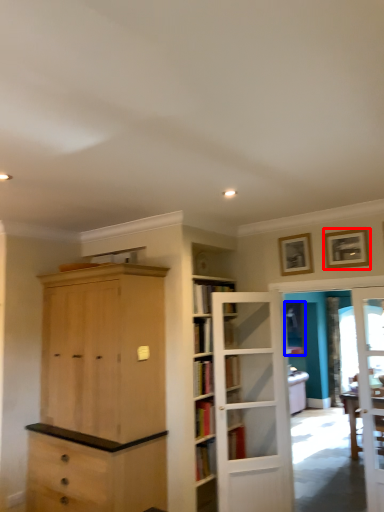
Question: Which of the following is the farthest to the observer, picture frame (highlighted by a red box) or window (highlighted by a blue box)?

Choices:
 (A) picture frame
 (B) window

Answer: (B)